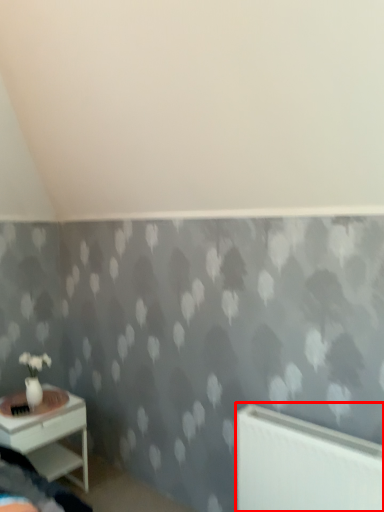
Question: From the image's perspective, what is the correct spatial relationship of radiator (annotated by the red box) in relation to nightstand?

Choices:
 (A) above
 (B) below

Answer: (A)